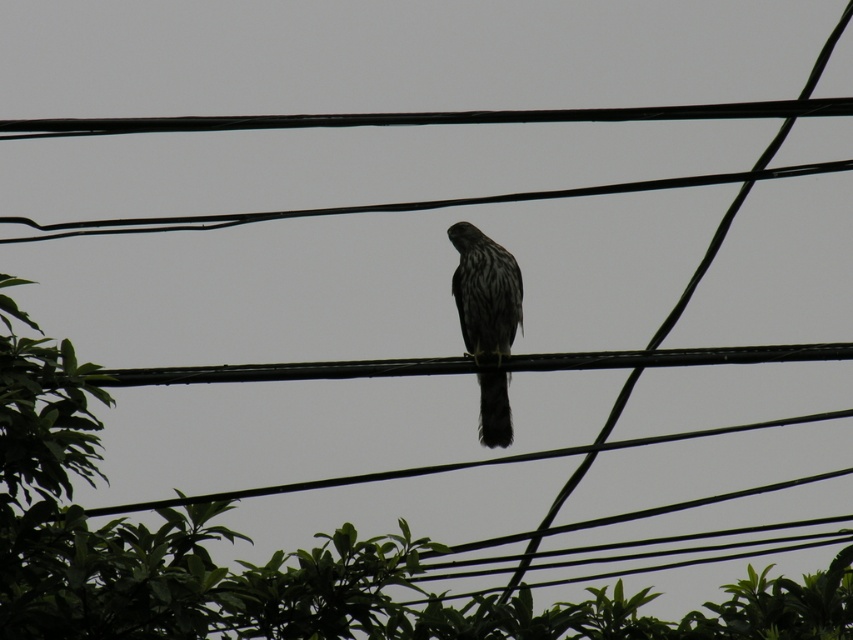
Question: Does green leafy tree at center appear on the left side of dark gray speckled falcon at center?

Choices:
 (A) yes
 (B) no

Answer: (A)

Question: Is green leafy tree at center positioned in front of dark gray speckled falcon at center?

Choices:
 (A) no
 (B) yes

Answer: (B)

Question: Among these points, which one is nearest to the camera?

Choices:
 (A) (416, 540)
 (B) (496, 396)

Answer: (A)

Question: Among these objects, which one is nearest to the camera?

Choices:
 (A) dark gray speckled falcon at center
 (B) green leafy tree at center

Answer: (B)

Question: In this image, where is green leafy tree at center located relative to dark gray speckled falcon at center?

Choices:
 (A) left
 (B) right

Answer: (A)